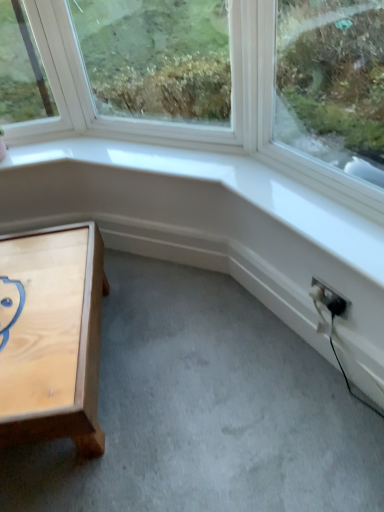
The width and height of the screenshot is (384, 512). Find the location of `free spot above light wood table at lower left (from a real-world perspective)`. free spot above light wood table at lower left (from a real-world perspective) is located at coordinates (38, 298).